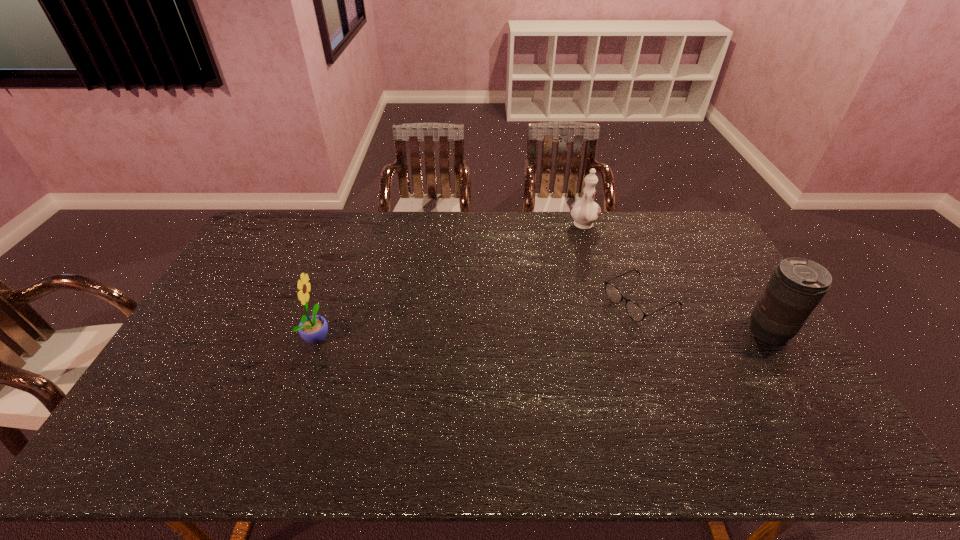
What are the coordinates of `free space on the desktop that is between the sunflower and the rightmost object and is positioned on the front-facing side of the spectacles` in the screenshot? It's located at (576, 333).

Locate an element on the screen. Image resolution: width=960 pixels, height=540 pixels. vacant space on the desktop that is between the sunflower and the telephoto lens and is positioned at the spout of the farthest object is located at coordinates (539, 334).